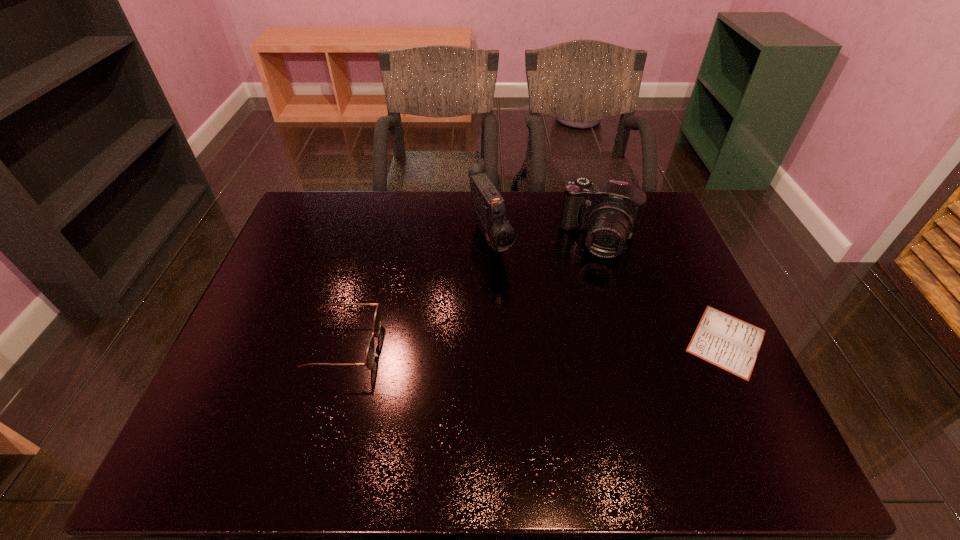
Locate an element on the screen. vacant area between the tallest object and the diary is located at coordinates (608, 290).

Identify the location of unoccupied position between the tallest object and the shortest object. (608, 290).

What are the coordinates of `empty location between the second object from left to right and the second tallest object` in the screenshot? It's located at (545, 239).

This screenshot has width=960, height=540. I want to click on vacant space in between the rightmost object and the third object from left to right, so click(663, 290).

This screenshot has width=960, height=540. Find the location of `free space between the third shortest object and the tallest object`. free space between the third shortest object and the tallest object is located at coordinates (545, 239).

At what (x,y) coordinates should I click in order to perform the action: click on free space that is in between the rightmost object and the tallest object. Please return your answer as a coordinate pair (x, y). This screenshot has height=540, width=960. Looking at the image, I should click on (608, 290).

Image resolution: width=960 pixels, height=540 pixels. Find the location of `free space that is in between the third object from left to right and the leftmost object`. free space that is in between the third object from left to right and the leftmost object is located at coordinates (472, 293).

At what (x,y) coordinates should I click in order to perform the action: click on vacant area that lies between the camera and the rightmost object. Please return your answer as a coordinate pair (x, y). Looking at the image, I should click on (663, 290).

Locate which object is the second closest to the camcorder. Please provide its 2D coordinates. Your answer should be formatted as a tuple, i.e. [(x, y)], where the tuple contains the x and y coordinates of a point satisfying the conditions above.

[(370, 353)]

The width and height of the screenshot is (960, 540). I want to click on object that is the closest to the camcorder, so pos(610,211).